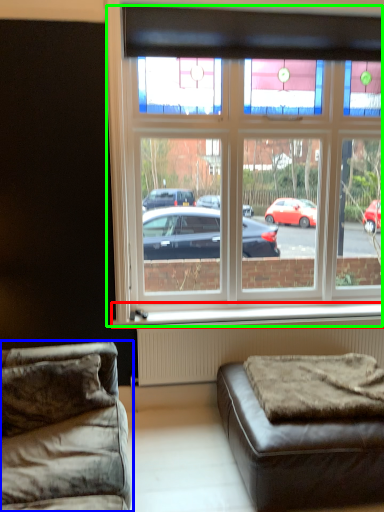
Question: Which is nearer to the window sill (highlighted by a red box)? studio couch (highlighted by a blue box) or window (highlighted by a green box).

Choices:
 (A) studio couch
 (B) window

Answer: (A)